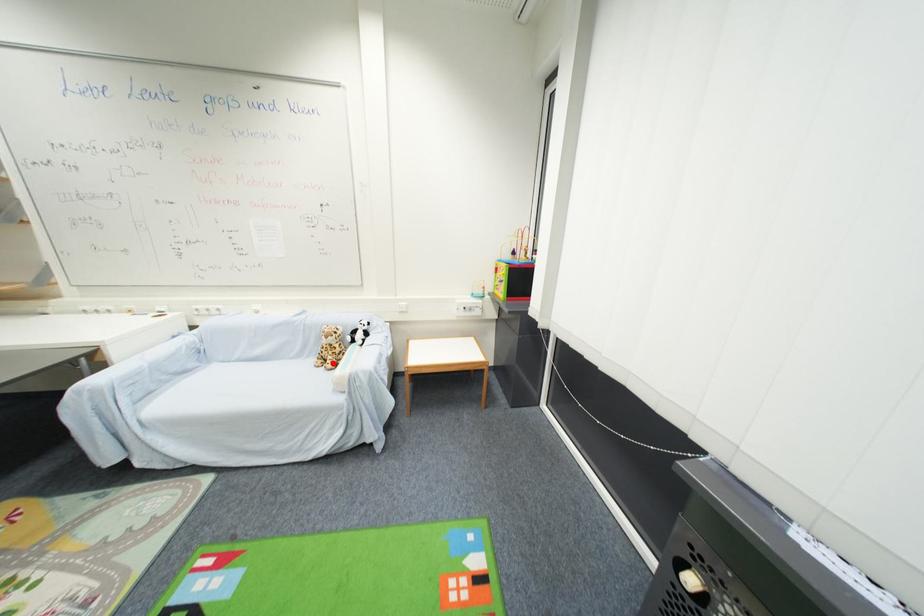
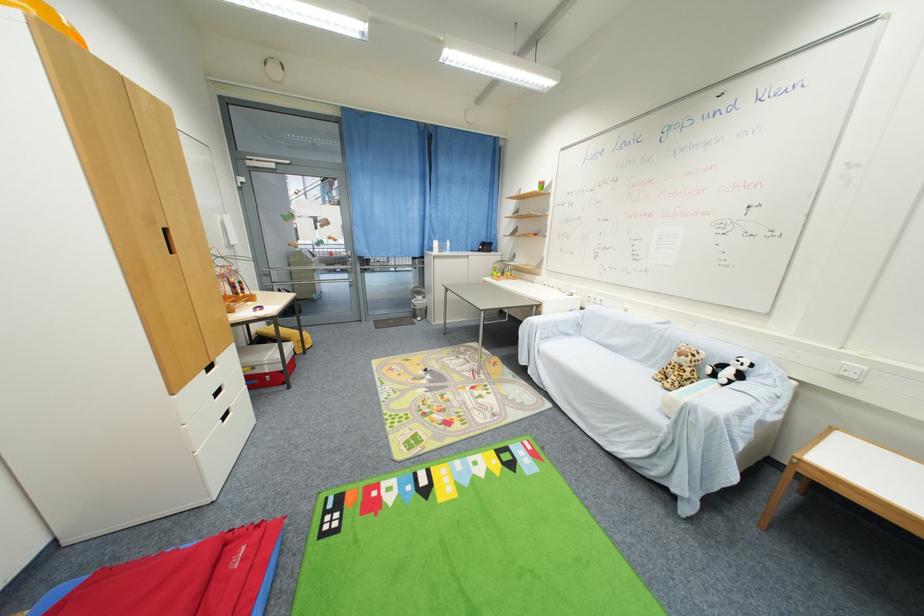
Question: I am providing you with two images of the same scene from different viewpoints. Image1 has a red point marked. In image2, the corresponding 3D location appears at what relative position? Reply with the corresponding letter.

Choices:
 (A) Closer
 (B) Farther

Answer: (A)